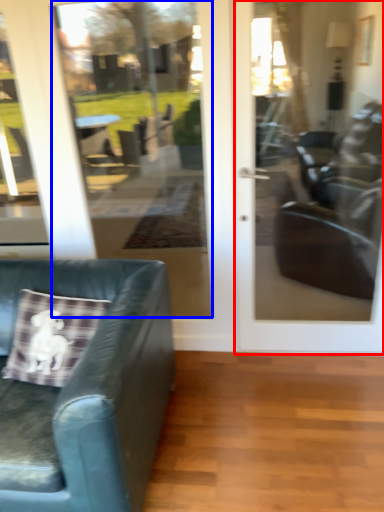
Question: Which object is further to the camera taking this photo, door (highlighted by a red box) or glass door (highlighted by a blue box)?

Choices:
 (A) door
 (B) glass door

Answer: (B)